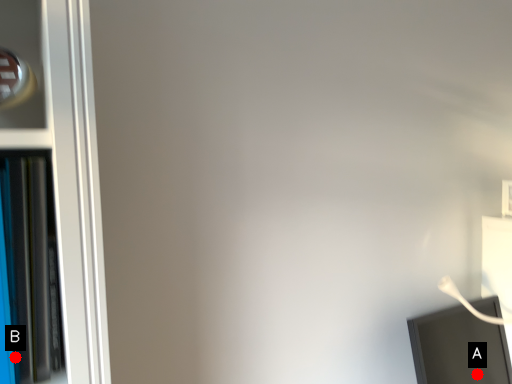
Question: Two points are circled on the image, labeled by A and B beside each circle. Which point appears closest to the camera in this image?

Choices:
 (A) A is closer
 (B) B is closer

Answer: (B)